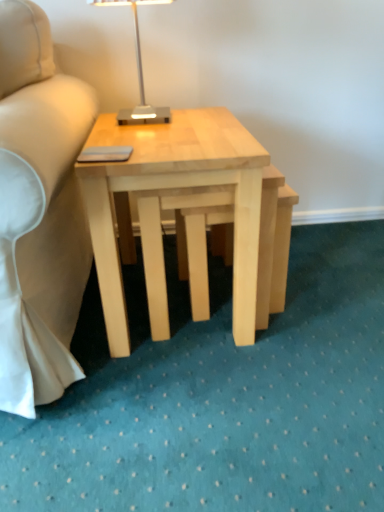
This screenshot has height=512, width=384. Identify the location of free spot in front of natural wood coffee table at center. (193, 413).